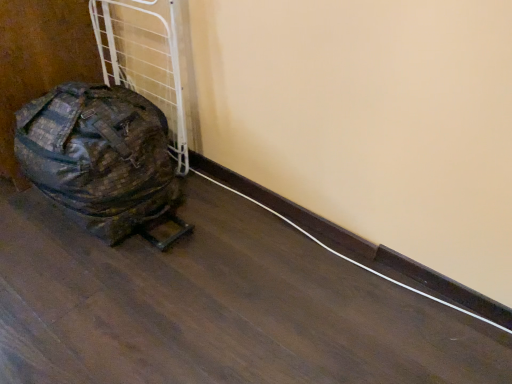
Question: Would you say white cable at lower center is to the left or to the right of camouflage fabric bag at left in the picture?

Choices:
 (A) left
 (B) right

Answer: (B)

Question: Based on their sizes in the image, would you say white cable at lower center is bigger or smaller than camouflage fabric bag at left?

Choices:
 (A) big
 (B) small

Answer: (B)

Question: From a real-world perspective, is white cable at lower center physically located above or below camouflage fabric bag at left?

Choices:
 (A) below
 (B) above

Answer: (A)

Question: Looking at the image, does camouflage fabric bag at left seem bigger or smaller compared to white cable at lower center?

Choices:
 (A) big
 (B) small

Answer: (A)

Question: From a real-world perspective, is camouflage fabric bag at left physically located above or below white cable at lower center?

Choices:
 (A) above
 (B) below

Answer: (A)

Question: Does point (19, 160) appear closer or farther from the camera than point (291, 225)?

Choices:
 (A) farther
 (B) closer

Answer: (B)

Question: Considering the relative positions of camouflage fabric bag at left and white cable at lower center in the image provided, is camouflage fabric bag at left to the left or to the right of white cable at lower center?

Choices:
 (A) right
 (B) left

Answer: (B)